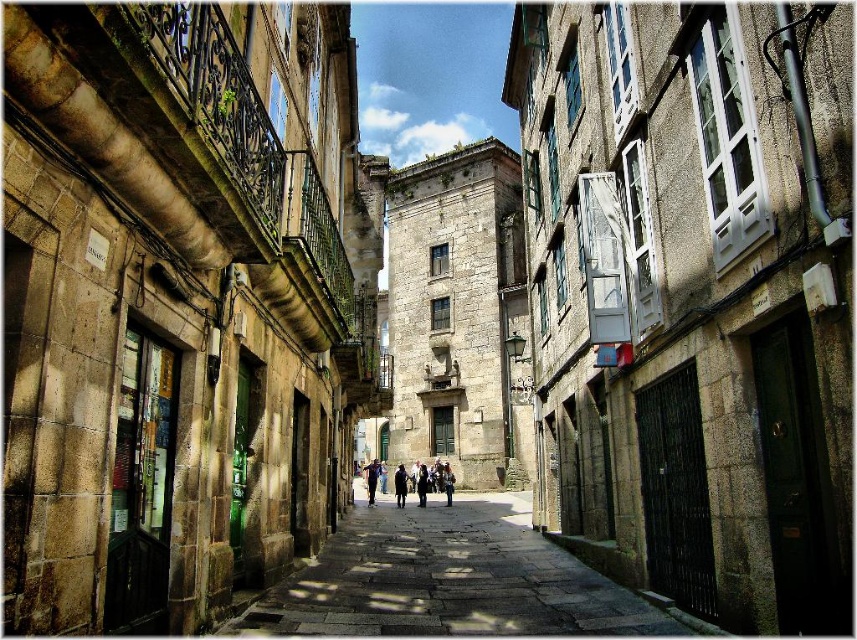
Question: Which is farther from the stone paved path at center?

Choices:
 (A) dark blue coat at center
 (B) dark blue jeans at center
 (C) blue denim jeans at center

Answer: (C)

Question: Does dark blue jeans at center appear over blue denim jeans at center?

Choices:
 (A) no
 (B) yes

Answer: (B)

Question: Estimate the real-world distances between objects in this image. Which object is farther from the stone paved path at center?

Choices:
 (A) dark blue jeans at center
 (B) blue denim jeans at center

Answer: (B)

Question: Which object is positioned farthest from the stone paved path at center?

Choices:
 (A) dark blue coat at center
 (B) blue denim jeans at center

Answer: (B)

Question: Can you confirm if blue denim jeans at center is smaller than dark blue coat at center?

Choices:
 (A) yes
 (B) no

Answer: (B)

Question: Is dark blue jeans at center below blue denim jeans at center?

Choices:
 (A) yes
 (B) no

Answer: (B)